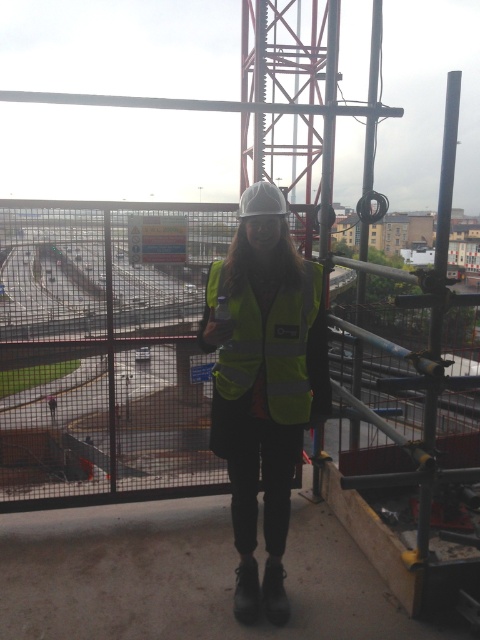
Question: Does metal mesh fence at center appear on the left side of high-visibility fabric safety vest at center?

Choices:
 (A) yes
 (B) no

Answer: (B)

Question: Which object is positioned closest to the high-visibility fabric safety vest at center?

Choices:
 (A) yellow reflective vest at center
 (B) metal mesh fence at center

Answer: (A)

Question: Does yellow reflective vest at center appear on the right side of high-visibility fabric safety vest at center?

Choices:
 (A) no
 (B) yes

Answer: (A)

Question: Considering the real-world distances, which object is closest to the metal mesh fence at center?

Choices:
 (A) high-visibility fabric safety vest at center
 (B) yellow reflective vest at center

Answer: (A)

Question: In this image, where is metal mesh fence at center located relative to high-visibility fabric safety vest at center?

Choices:
 (A) right
 (B) left

Answer: (A)

Question: Among these objects, which one is nearest to the camera?

Choices:
 (A) metal mesh fence at center
 (B) yellow reflective vest at center

Answer: (A)